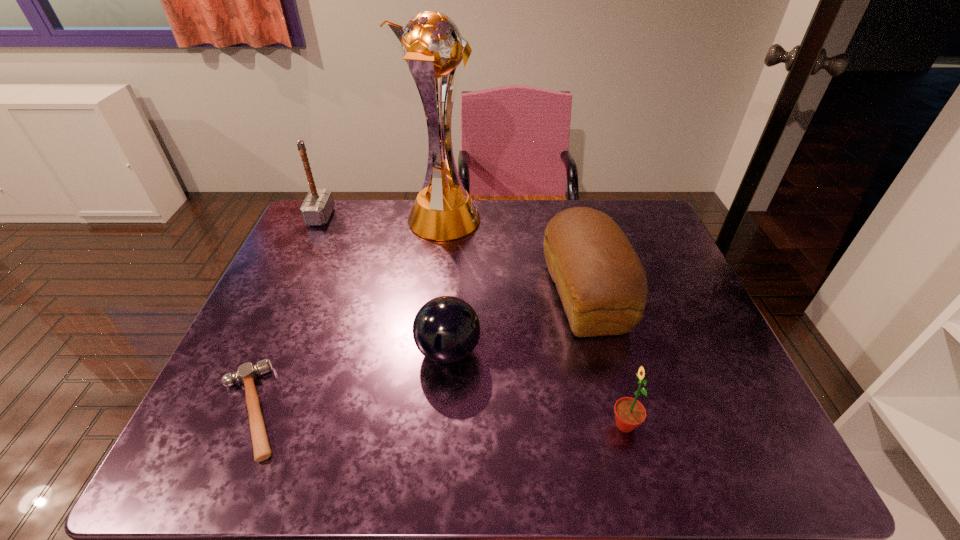
The height and width of the screenshot is (540, 960). In order to click on the tallest object in this screenshot , I will do `click(431, 44)`.

Locate an element on the screen. This screenshot has height=540, width=960. the farther hammer is located at coordinates (318, 205).

The height and width of the screenshot is (540, 960). I want to click on the second tallest object, so click(318, 205).

You are a GUI agent. You are given a task and a screenshot of the screen. Output one action in this format:
    pyautogui.click(x=<x>, y=<y>)
    Task: Click on the bread
    This screenshot has height=540, width=960.
    Given the screenshot: What is the action you would take?
    pyautogui.click(x=601, y=281)

At what (x,y) coordinates should I click in order to perform the action: click on sunflower. Please return your answer as a coordinate pair (x, y). The image size is (960, 540). Looking at the image, I should click on (629, 413).

The image size is (960, 540). Identify the location of bowling ball. (446, 329).

Where is `the nearer hammer`? This screenshot has height=540, width=960. the nearer hammer is located at coordinates (247, 373).

At what (x,y) coordinates should I click in order to perform the action: click on the shortest object. Please return your answer as a coordinate pair (x, y). The image size is (960, 540). Looking at the image, I should click on (247, 373).

Find the location of a particular element. The height and width of the screenshot is (540, 960). vacant region located on the front-facing side of the trophy is located at coordinates (524, 221).

Identify the location of vacant region located 0.110m on the striking surface of the second tallest object. click(x=366, y=217).